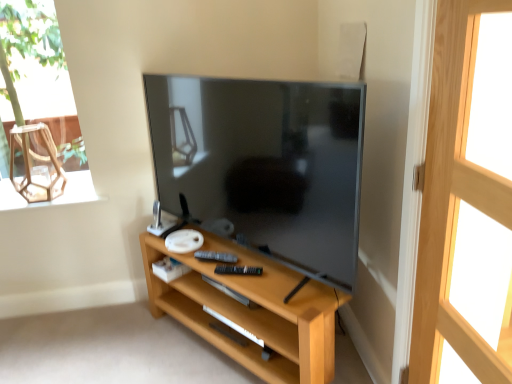
Question: Considering the positions of clear glass window sill at left and transparent glass armchair at upper left in the image, is clear glass window sill at left wider or thinner than transparent glass armchair at upper left?

Choices:
 (A) thin
 (B) wide

Answer: (B)

Question: From the image's perspective, is clear glass window sill at left above or below transparent glass armchair at upper left?

Choices:
 (A) above
 (B) below

Answer: (B)

Question: Which object is positioned closest to the matte black tv at center?

Choices:
 (A) light wood screen door at right
 (B) transparent glass armchair at upper left
 (C) light wood shelf at center
 (D) clear glass window sill at left
 (E) clear glass window at upper left

Answer: (C)

Question: Which of these objects is positioned farthest from the matte black tv at center?

Choices:
 (A) black plastic remote at center
 (B) clear glass window sill at left
 (C) light wood shelf at center
 (D) clear glass window at upper left
 (E) light wood screen door at right

Answer: (D)